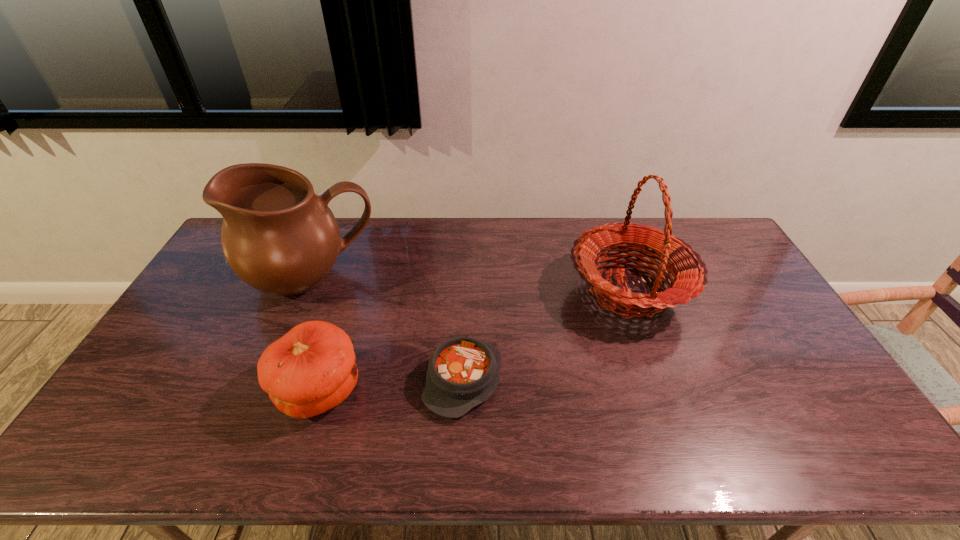
Identify the location of cream pitcher located at the far edge. The image size is (960, 540). (278, 236).

I want to click on object positioned at the near edge, so click(x=311, y=369).

The height and width of the screenshot is (540, 960). Find the location of `object that is at the left edge`. object that is at the left edge is located at coordinates (278, 236).

At what (x,y) coordinates should I click in order to perform the action: click on object that is at the far left corner. Please return your answer as a coordinate pair (x, y). This screenshot has height=540, width=960. Looking at the image, I should click on (278, 236).

Identify the location of vacant point at the far edge. This screenshot has width=960, height=540. (475, 217).

At what (x,y) coordinates should I click in order to perform the action: click on free space at the near edge. Please return your answer as a coordinate pair (x, y). This screenshot has width=960, height=540. Looking at the image, I should click on (779, 445).

Locate an element on the screen. This screenshot has width=960, height=540. vacant space at the left edge of the desktop is located at coordinates (205, 322).

The width and height of the screenshot is (960, 540). In the image, there is a desktop. Find the location of `vacant area at the far right corner`. vacant area at the far right corner is located at coordinates (692, 231).

Locate an element on the screen. empty location between the shortest object and the cream pitcher is located at coordinates (388, 329).

Locate an element on the screen. This screenshot has width=960, height=540. free space that is in between the cream pitcher and the basket is located at coordinates (470, 285).